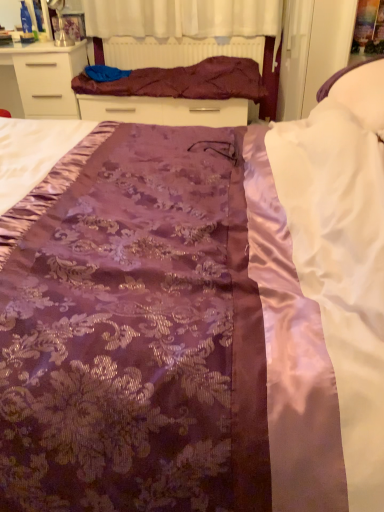
Question: Is purple satin bed frame at upper center to the left of purple satin blanket at upper center from the viewer's perspective?

Choices:
 (A) no
 (B) yes

Answer: (A)

Question: Is purple satin bed frame at upper center outside of purple satin blanket at upper center?

Choices:
 (A) yes
 (B) no

Answer: (A)

Question: Is purple satin bed frame at upper center turned away from purple satin blanket at upper center?

Choices:
 (A) no
 (B) yes

Answer: (B)

Question: Does purple satin bed frame at upper center have a larger size compared to purple satin blanket at upper center?

Choices:
 (A) yes
 (B) no

Answer: (B)

Question: Is purple satin bed frame at upper center wider than purple satin blanket at upper center?

Choices:
 (A) yes
 (B) no

Answer: (B)

Question: From the image's perspective, relative to white satin pillow at upper right, is purple satin blanket at upper center above or below?

Choices:
 (A) below
 (B) above

Answer: (B)

Question: Looking at the image, does purple satin blanket at upper center seem bigger or smaller compared to white satin pillow at upper right?

Choices:
 (A) small
 (B) big

Answer: (B)

Question: Relative to white satin pillow at upper right, is purple satin blanket at upper center in front or behind?

Choices:
 (A) front
 (B) behind

Answer: (B)

Question: Considering the positions of purple satin blanket at upper center and white satin pillow at upper right in the image, is purple satin blanket at upper center taller or shorter than white satin pillow at upper right?

Choices:
 (A) tall
 (B) short

Answer: (B)

Question: From the image's perspective, is purple satin bed frame at upper center positioned above or below matte white chest of drawers at upper left?

Choices:
 (A) above
 (B) below

Answer: (A)

Question: From a real-world perspective, is purple satin bed frame at upper center positioned above or below matte white chest of drawers at upper left?

Choices:
 (A) below
 (B) above

Answer: (B)

Question: Is purple satin bed frame at upper center wider or thinner than matte white chest of drawers at upper left?

Choices:
 (A) thin
 (B) wide

Answer: (A)

Question: Is purple satin bed frame at upper center taller or shorter than matte white chest of drawers at upper left?

Choices:
 (A) tall
 (B) short

Answer: (B)

Question: Relative to matte white chest of drawers at upper left, is purple satin blanket at upper center in front or behind?

Choices:
 (A) behind
 (B) front

Answer: (B)

Question: Looking at their shapes, would you say purple satin blanket at upper center is wider or thinner than matte white chest of drawers at upper left?

Choices:
 (A) thin
 (B) wide

Answer: (A)